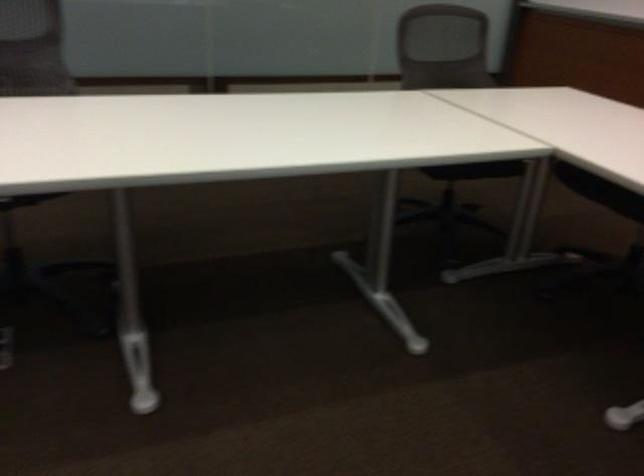
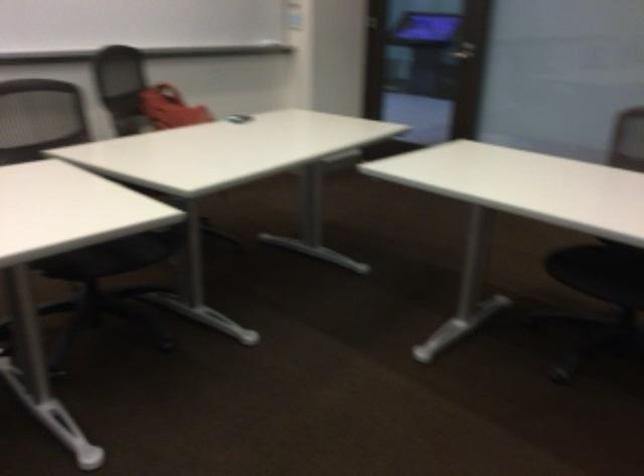
Question: The camera is either moving clockwise (left) or counter-clockwise (right) around the object. The first image is from the beginning of the video and the second image is from the end. Is the camera moving left or right when shooting the video?

Choices:
 (A) Left
 (B) Right

Answer: (B)